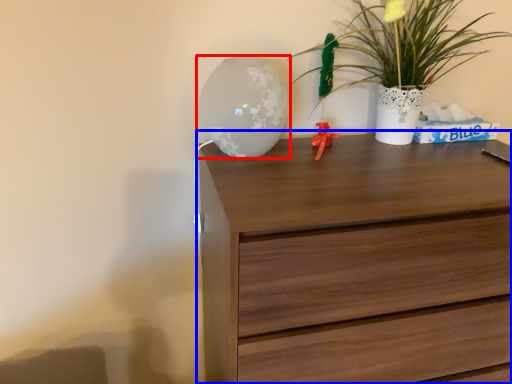
Question: Which of the following is the closest to the observer, table lamp (highlighted by a red box) or chest of drawers (highlighted by a blue box)?

Choices:
 (A) table lamp
 (B) chest of drawers

Answer: (B)